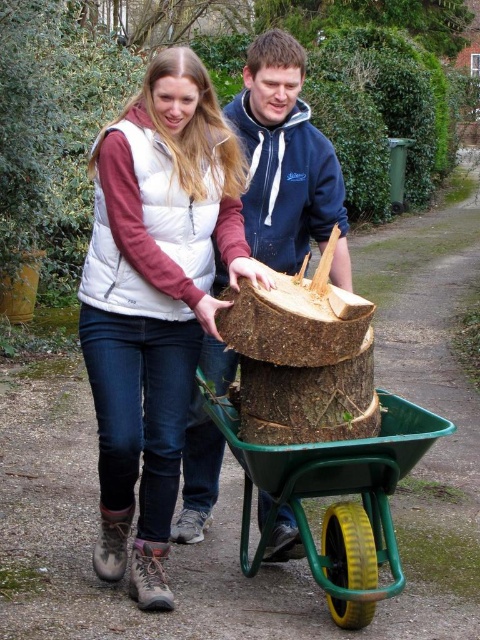
Question: Which point appears farthest from the camera in this image?

Choices:
 (A) (216, 413)
 (B) (171, 244)
 (C) (278, 179)

Answer: (C)

Question: Does white fleece vest at upper left appear on the left side of green plastic cart at center?

Choices:
 (A) no
 (B) yes

Answer: (B)

Question: Which point is closer to the camera?

Choices:
 (A) (199, 65)
 (B) (407, 432)
 (C) (217, 490)

Answer: (A)

Question: Is white fleece vest at upper left positioned behind green plastic cart at center?

Choices:
 (A) no
 (B) yes

Answer: (B)

Question: Which is nearer to the blue fleece jacket at center?

Choices:
 (A) white fleece vest at upper left
 (B) green plastic cart at center

Answer: (A)

Question: Does white fleece vest at upper left have a smaller size compared to blue fleece jacket at center?

Choices:
 (A) yes
 (B) no

Answer: (B)